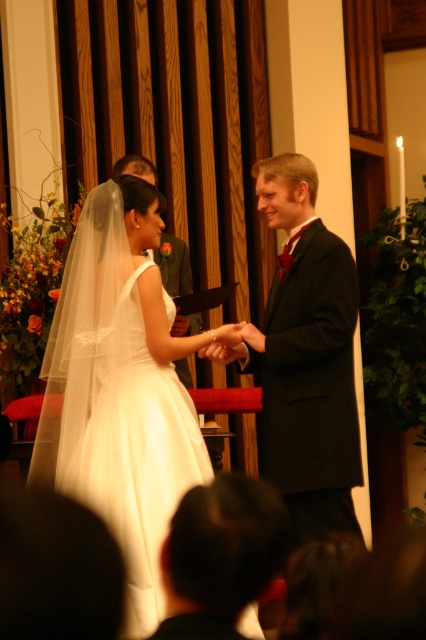
You are a photographer at the wedding ceremony. You need to focus your camera on both points, point 1 at point (167, 403) and point 2 at point (120, 164). Which point should you focus on first to ensure the closest subject is sharp?

You should focus on point (167, 403) first because it is closer to the viewer than point (120, 164), ensuring the closest subject is sharp.

You are a photographer at the wedding ceremony. You want to take a photo of the groom wearing the black satin suit at center and the smooth black suit at center. Which one is positioned closer to the camera?

The black satin suit at center is closer to the viewer than the smooth black suit at center, so the black satin suit at center will appear closer to the camera in the photo.

You are a photographer at the wedding ceremony. You need to capture a photo of the white satin dress at center and the black satin suit at center. From the perspective of the photographer, which one is positioned lower in the frame?

The white satin dress at center is positioned lower than the black satin suit at center in the frame.